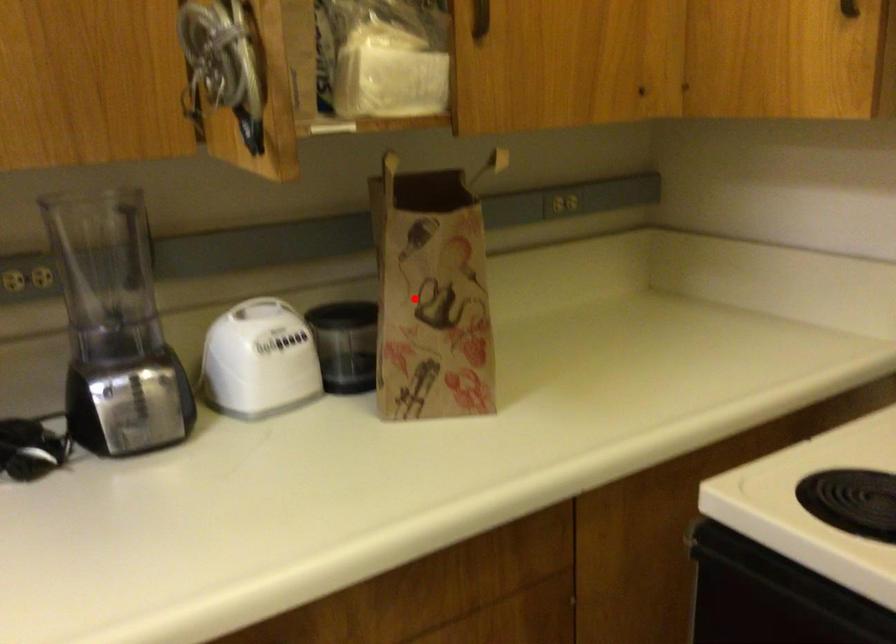
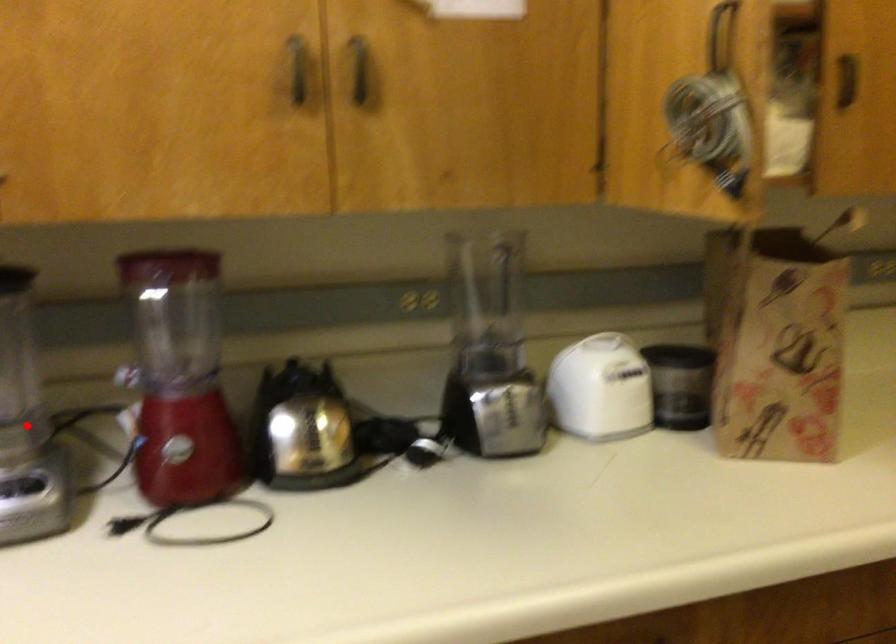
I am providing you with two images of the same scene from different viewpoints. A red point is marked on the first image and another point is marked on the second image. Is the marked point in image1 the same physical position as the marked point in image2?

No